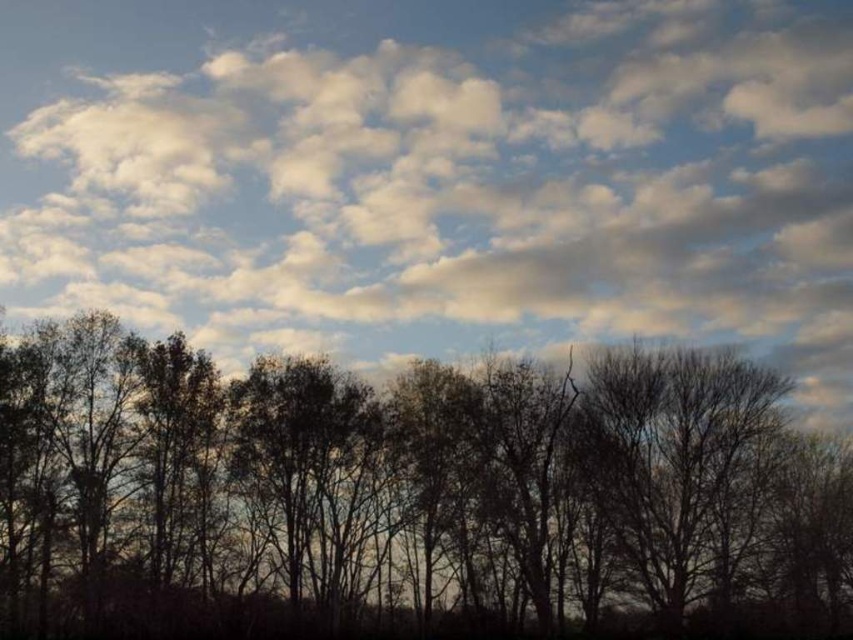
You are an airplane pilot flying at a low altitude. You notice the silhouette tree at lower center and the white fluffy cloud at upper center in your view. Which object is closer to your airplane?

The silhouette tree at lower center is behind the white fluffy cloud at upper center, so the white fluffy cloud at upper center is closer to the airplane.

You are an artist trying to paint the scene. You want to ensure the white fluffy cloud at upper center and the silhouette tree at lower center are proportionally accurate. Which object should you draw first to maintain the correct size relationship?

You should draw the silhouette tree at lower center first because the white fluffy cloud at upper center is taller than it, so starting with the smaller object ensures proper scaling when adding the larger one.

In the scene shown: You are a drone operator trying to position your drone between the white fluffy cloud at upper center and the dense line of trees in the foreground. According to the coordinates provided, where should you aim the drone?

The white fluffy cloud at upper center is located at point (437, 173). Therefore, you should aim the drone between the coordinates of the cloud and the position of the dense line of trees in the foreground.